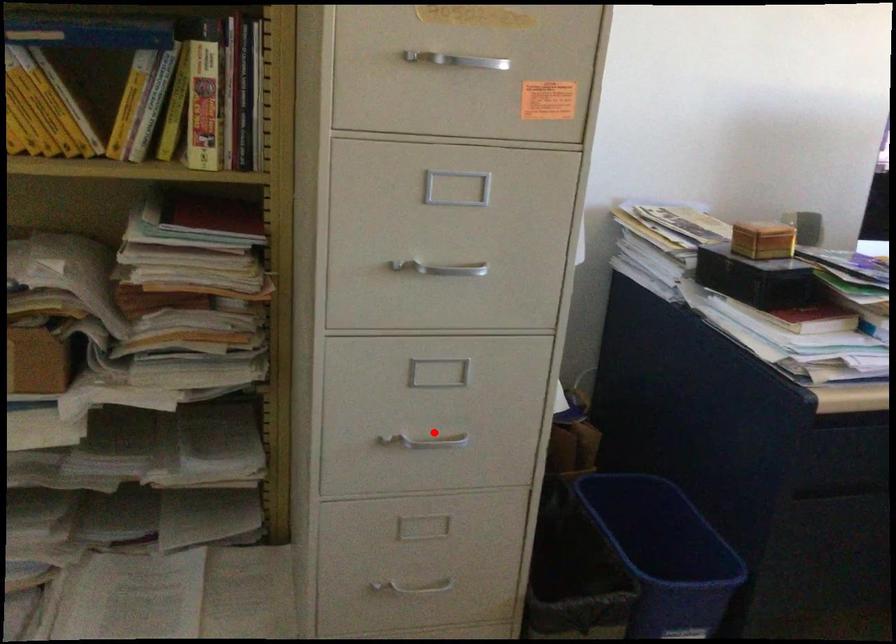
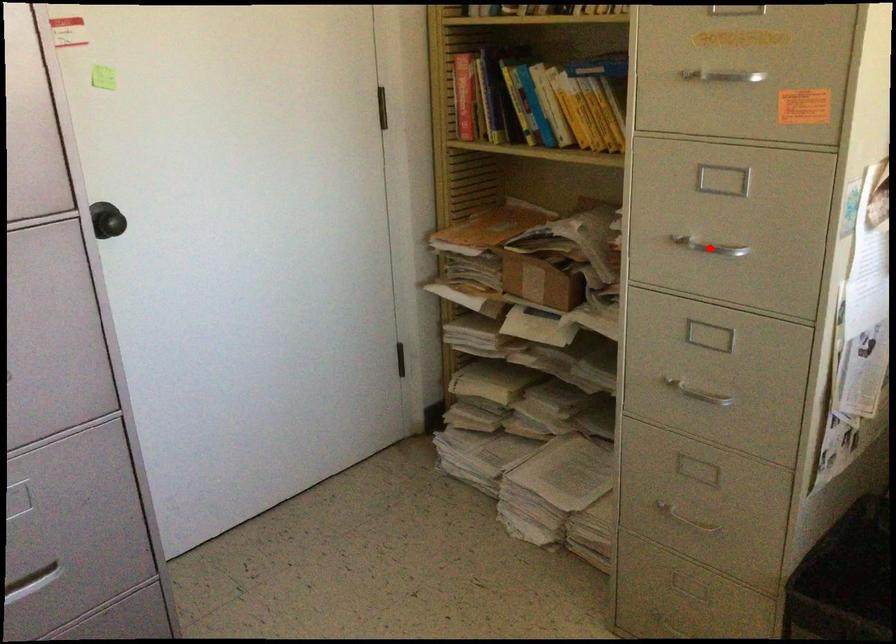
I am providing you with two images of the same scene from different viewpoints. A red point is marked on the first image and another point is marked on the second image. Do the highlighted points in image1 and image2 indicate the same real-world spot?

No